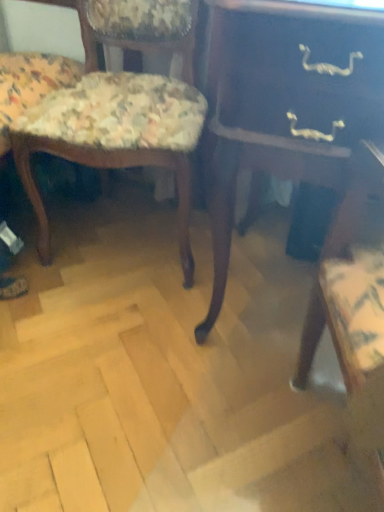
Question: From the image's perspective, is floral fabric chair at left, acting as the 1th chair starting from the right, above or below floral fabric chair at left, which appears as the 1th chair when viewed from the left?

Choices:
 (A) below
 (B) above

Answer: (A)

Question: Is floral fabric chair at left, the 2th chair positioned from the left, wider or thinner than floral fabric chair at left, which appears as the 1th chair when viewed from the left?

Choices:
 (A) wide
 (B) thin

Answer: (B)

Question: Based on their relative distances, which object is nearer to the floral fabric chair at left, which appears as the 1th chair when viewed from the left?

Choices:
 (A) dark wood table at center
 (B) floral fabric chair at left, the 2th chair positioned from the left

Answer: (B)

Question: Estimate the real-world distances between objects in this image. Which object is farther from the floral fabric chair at left, the 2th chair positioned from the left?

Choices:
 (A) dark wood table at center
 (B) floral fabric chair at left, which appears as the 1th chair when viewed from the left

Answer: (A)